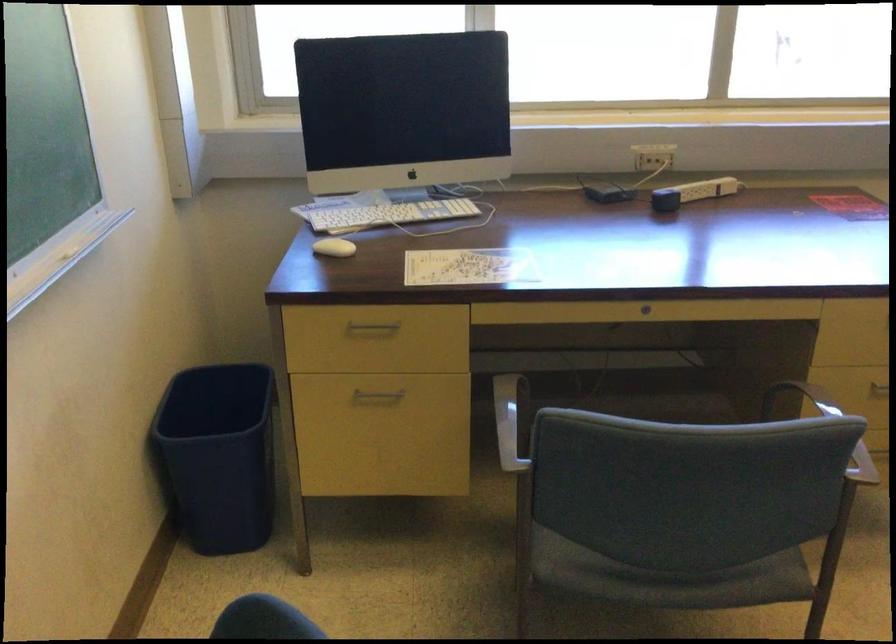
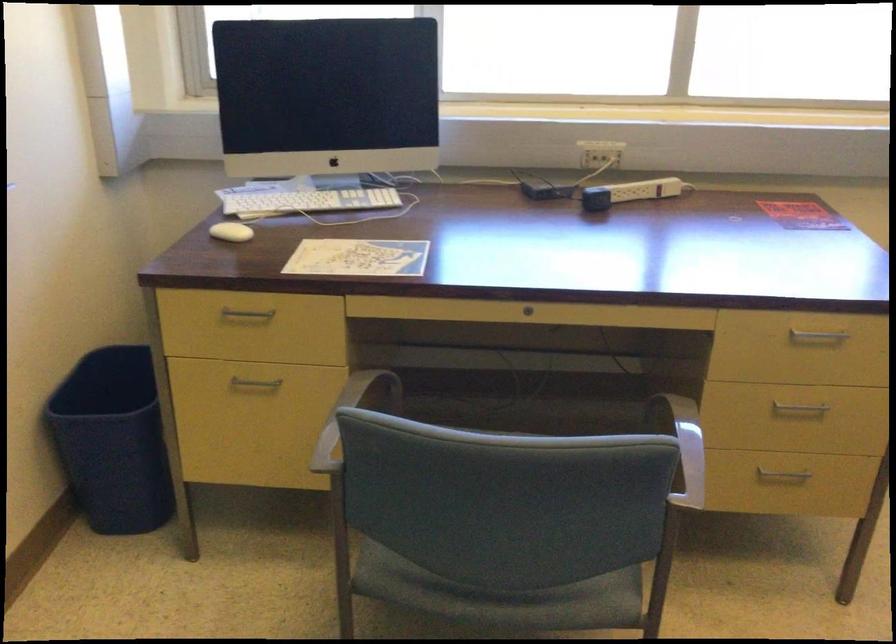
The point at (368,324) is marked in the first image. Where is the corresponding point in the second image?

(247, 313)